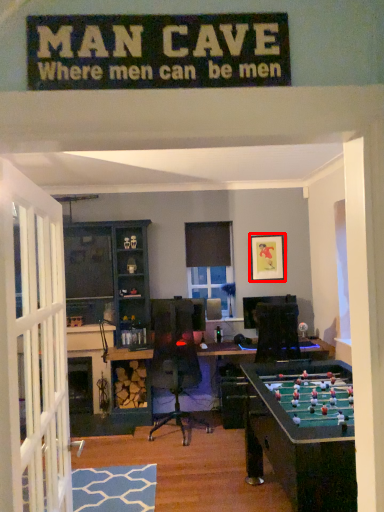
Question: Considering the relative positions of picture frame (annotated by the red box) and entertainment center in the image provided, where is picture frame (annotated by the red box) located with respect to the staircase?

Choices:
 (A) left
 (B) right

Answer: (B)